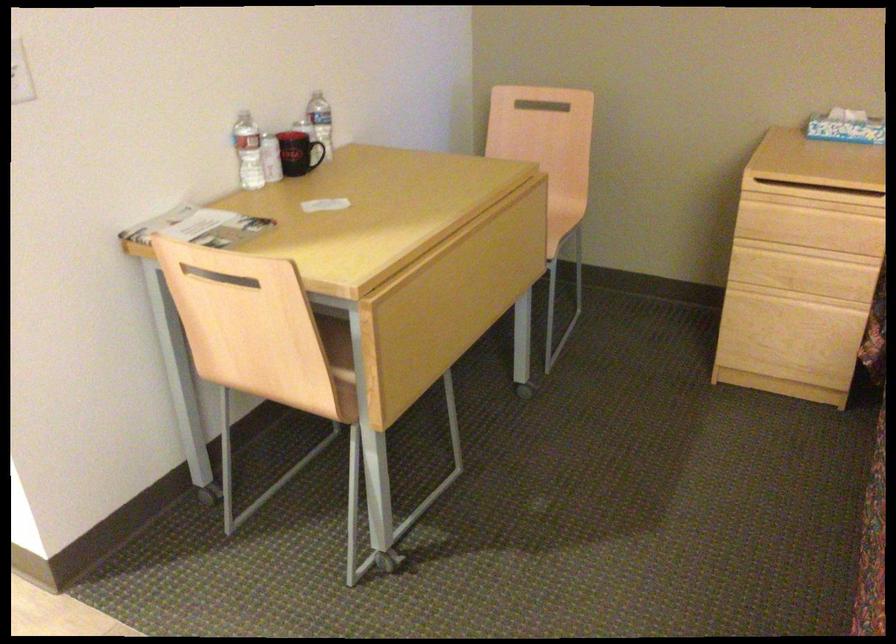
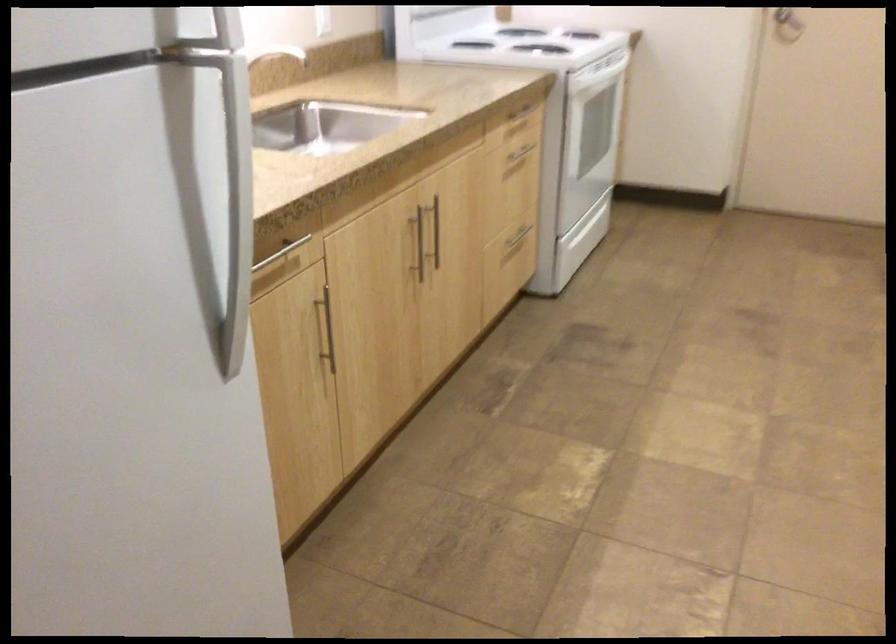
The first image is from the beginning of the video and the second image is from the end. How did the camera likely rotate when shooting the video?

The camera rotated toward left-down.